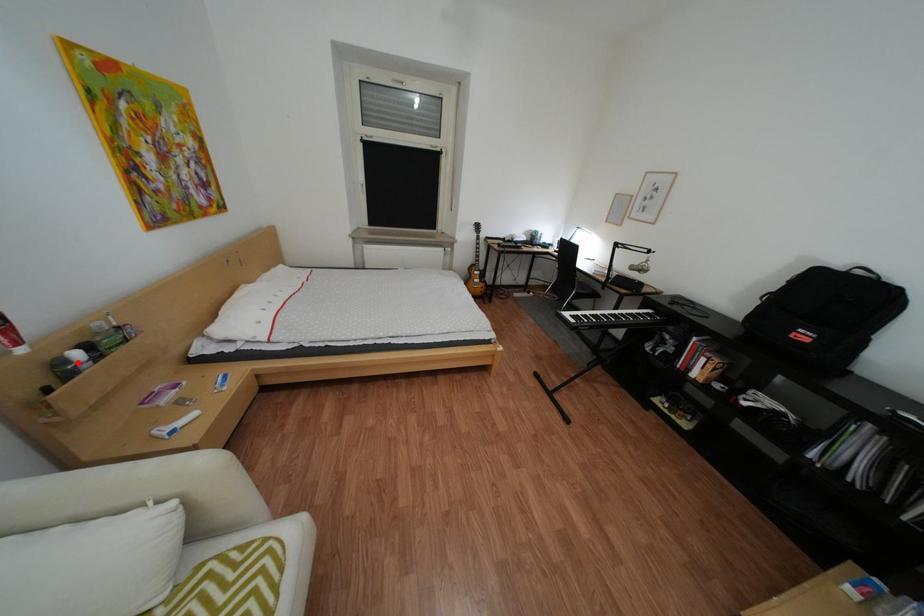
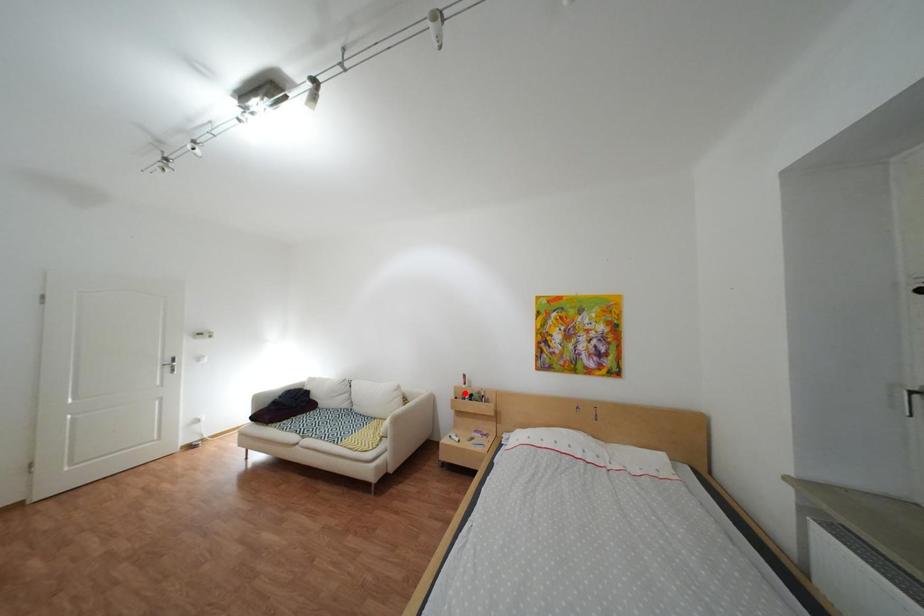
I am providing you with two images of the same scene from different viewpoints. A red point is marked on the first image and another point is marked on the second image. Do the highlighted points in image1 and image2 indicate the same real-world spot?

No